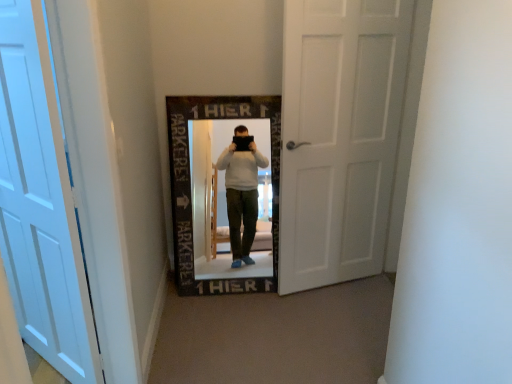
Question: In the image, is white matte door at left, which appears as the second door when viewed from the right, positioned in front of or behind white matte door at center, the 2th door when ordered from front to back?

Choices:
 (A) behind
 (B) front

Answer: (B)

Question: From the image's perspective, relative to white matte door at center, the second door viewed from the left, is white matte door at left, placed as the 2th door when sorted from back to front, above or below?

Choices:
 (A) below
 (B) above

Answer: (A)

Question: Is point (32, 289) positioned closer to the camera than point (307, 77)?

Choices:
 (A) closer
 (B) farther

Answer: (A)

Question: From the image's perspective, is white matte door at center, the 2th door when ordered from front to back, positioned above or below white matte door at left, placed as the 2th door when sorted from back to front?

Choices:
 (A) below
 (B) above

Answer: (B)

Question: In the image, is white matte door at center, which appears as the 1th door when viewed from the back, positioned in front of or behind white matte door at left, placed as the 2th door when sorted from back to front?

Choices:
 (A) behind
 (B) front

Answer: (A)

Question: From a real-world perspective, relative to white matte door at left, marked as the 1th door in a front-to-back arrangement, is white matte door at center, which appears as the 1th door when viewed from the back, vertically above or below?

Choices:
 (A) above
 (B) below

Answer: (A)

Question: Looking at their shapes, would you say white matte door at center, positioned as the first door in right-to-left order, is wider or thinner than white matte door at left, which is counted as the first door, starting from the left?

Choices:
 (A) wide
 (B) thin

Answer: (B)